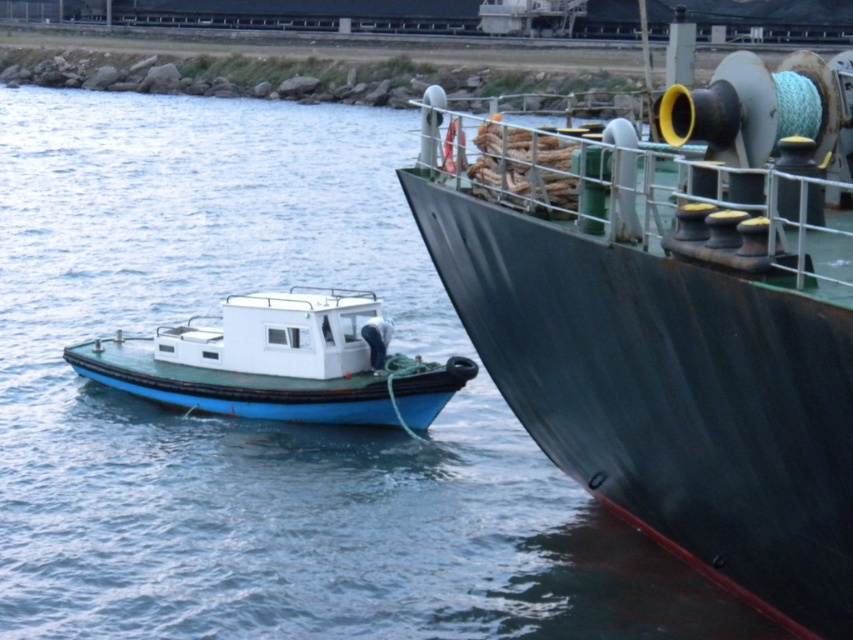
Question: From the image, what is the correct spatial relationship of rusty metal ship at right in relation to blue matte boat at left?

Choices:
 (A) left
 (B) right

Answer: (B)

Question: Which point appears closest to the camera in this image?

Choices:
 (A) (91, 356)
 (B) (697, 268)

Answer: (B)

Question: Can you confirm if rusty metal ship at right is bigger than blue matte boat at left?

Choices:
 (A) yes
 (B) no

Answer: (A)

Question: Can you confirm if rusty metal ship at right is bigger than blue matte boat at left?

Choices:
 (A) yes
 (B) no

Answer: (A)

Question: Among these points, which one is farthest from the camera?

Choices:
 (A) (352, 381)
 (B) (811, 388)

Answer: (A)